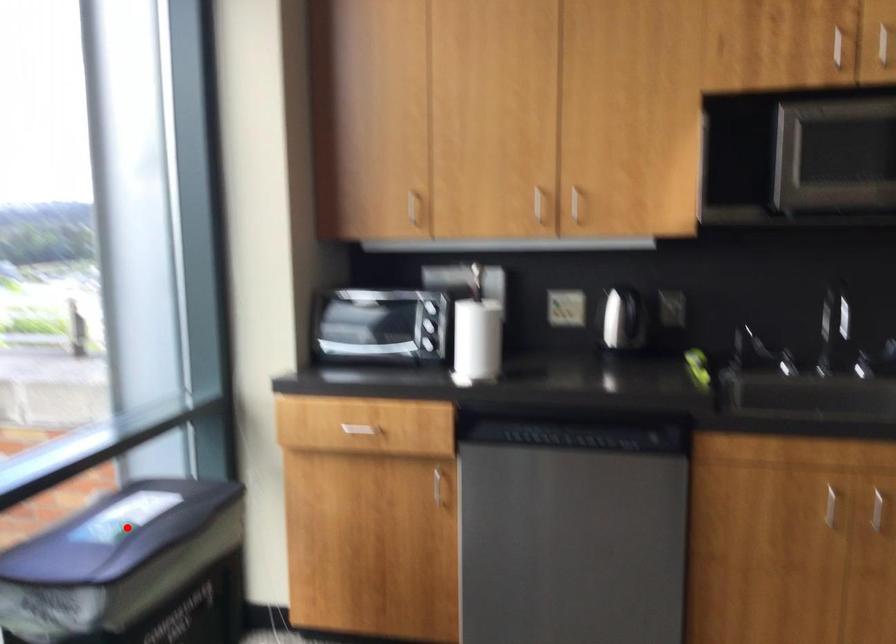
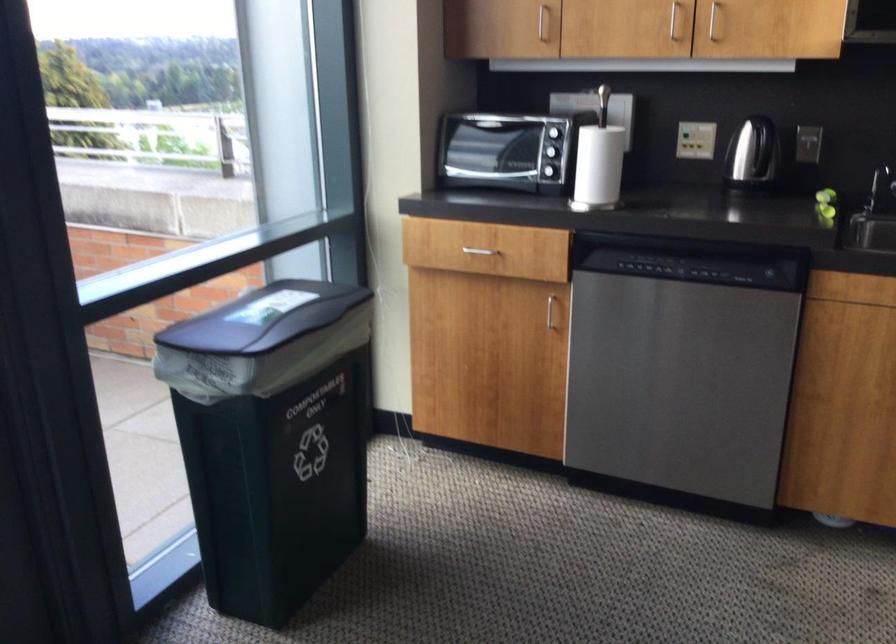
In the second image, find the point that corresponds to the highlighted location in the first image.

(262, 319)